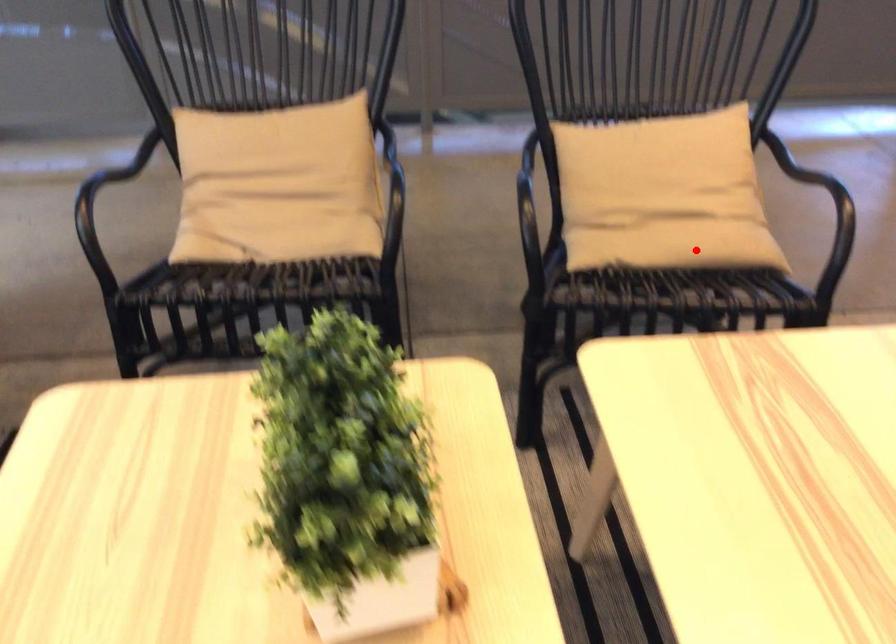
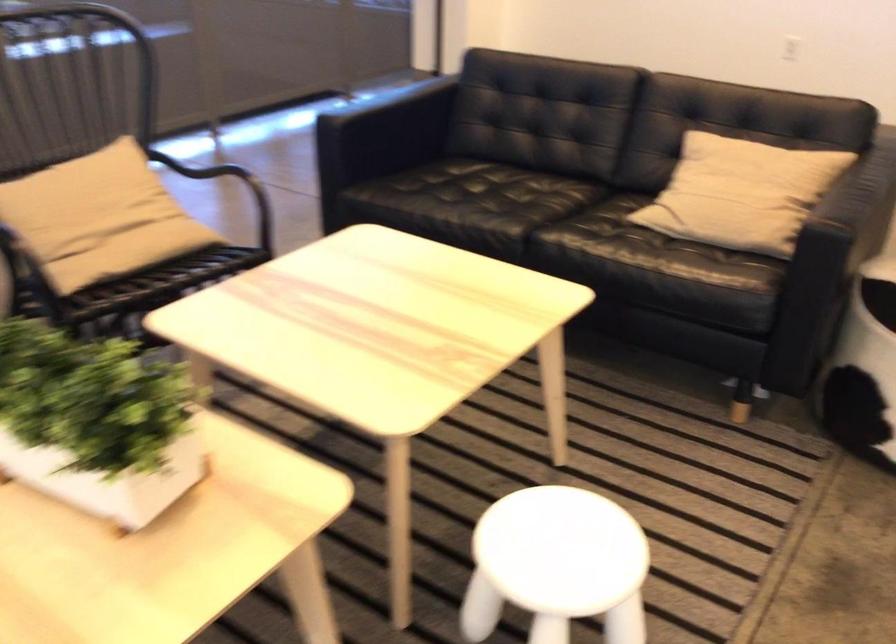
Question: I am providing you with two images of the same scene from different viewpoints. Image1 has a red point marked. In image2, the corresponding 3D location appears at what relative position? Reply with the corresponding letter.

Choices:
 (A) Closer
 (B) Farther

Answer: (B)